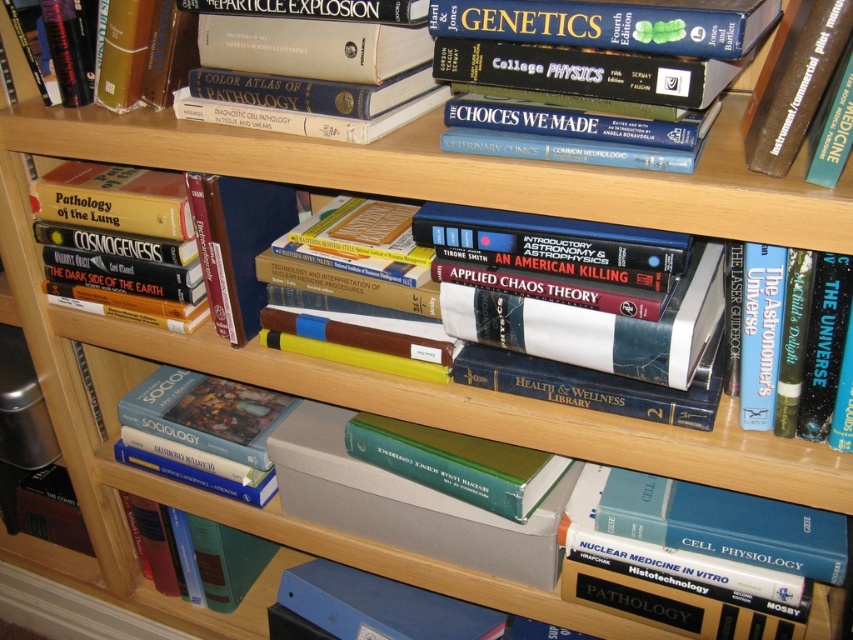
Does hardcover book at center have a lesser height compared to hardcover book at upper center?

No, hardcover book at center is not shorter than hardcover book at upper center.

Which is more to the right, hardcover book at center or hardcover book at upper center?

hardcover book at center is more to the right.

Between point (550, 365) and point (409, 145), which one is positioned behind?

The point (550, 365) is behind.

I want to click on hardcover book at center, so click(x=587, y=317).

Who is positioned more to the right, blue hardcover book at right or hardcover book at lower left?

From the viewer's perspective, blue hardcover book at right appears more on the right side.

Consider the image. Is blue hardcover book at right to the right of hardcover book at lower left from the viewer's perspective?

Correct, you'll find blue hardcover book at right to the right of hardcover book at lower left.

Is point (747, 305) closer to viewer compared to point (146, 520)?

Yes, it is.

Find the location of a particular element. This screenshot has height=640, width=853. blue hardcover book at right is located at coordinates (809, 340).

Is hardcover book at center to the left of hardcover book at upper right from the viewer's perspective?

Indeed, hardcover book at center is positioned on the left side of hardcover book at upper right.

Can you confirm if hardcover book at center is bigger than hardcover book at upper right?

Yes.

Which is in front, point (555, 346) or point (788, 52)?

Point (788, 52) is in front.

Where is `hardcover book at center`? The width and height of the screenshot is (853, 640). hardcover book at center is located at coordinates (x=587, y=317).